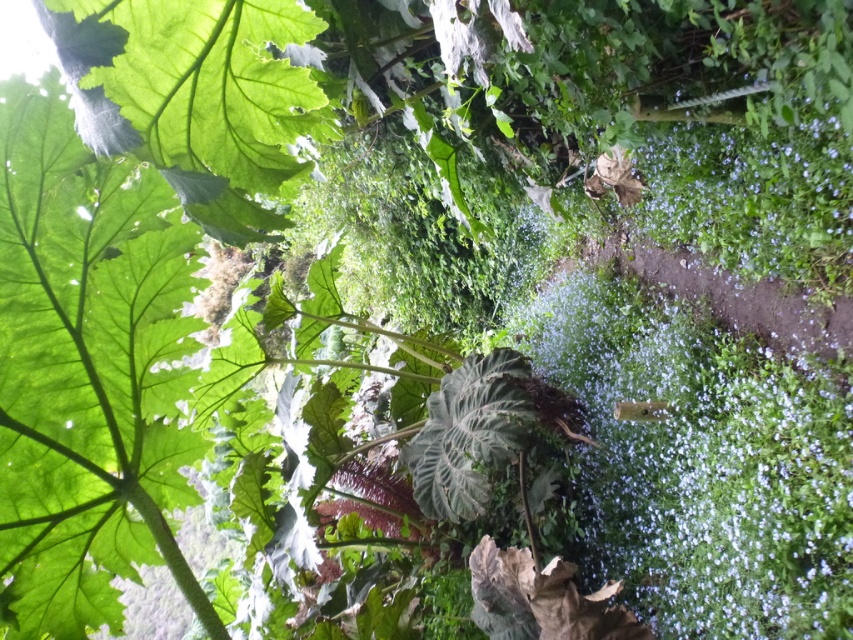
Question: Which point appears closest to the camera in this image?

Choices:
 (A) (821, 161)
 (B) (456, 387)
 (C) (114, 564)
 (D) (618, 330)

Answer: (C)

Question: Does white matte flowers at center have a smaller size compared to dark green textured leaf at center?

Choices:
 (A) no
 (B) yes

Answer: (A)

Question: Which object appears closest to the camera in this image?

Choices:
 (A) dark green textured leaf at center
 (B) green matte leaf at center

Answer: (B)

Question: Which of the following is the closest to the observer?

Choices:
 (A) purple matte flower at center-right
 (B) white matte flowers at center

Answer: (B)

Question: Does purple matte flower at center-right appear over dark green textured leaf at center?

Choices:
 (A) no
 (B) yes

Answer: (B)

Question: From the image, what is the correct spatial relationship of green matte leaf at center in relation to purple matte flower at center-right?

Choices:
 (A) left
 (B) right

Answer: (A)